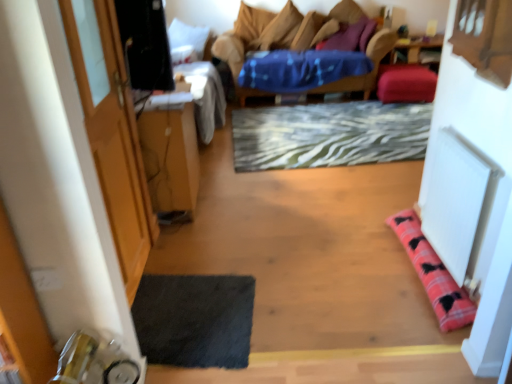
This screenshot has width=512, height=384. Identify the location of vacant area situated below zebra-patterned rug at center (from a real-world perspective). (326, 128).